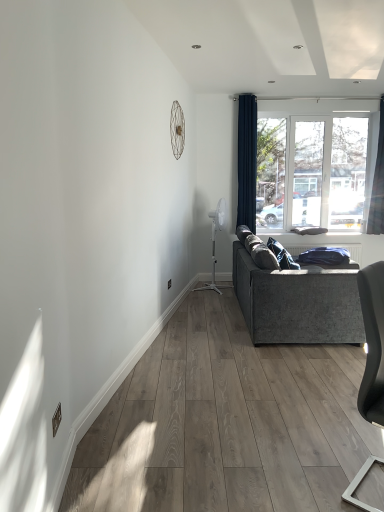
Identify the location of unoccupied space behind matte gray chair at lower right. (336, 440).